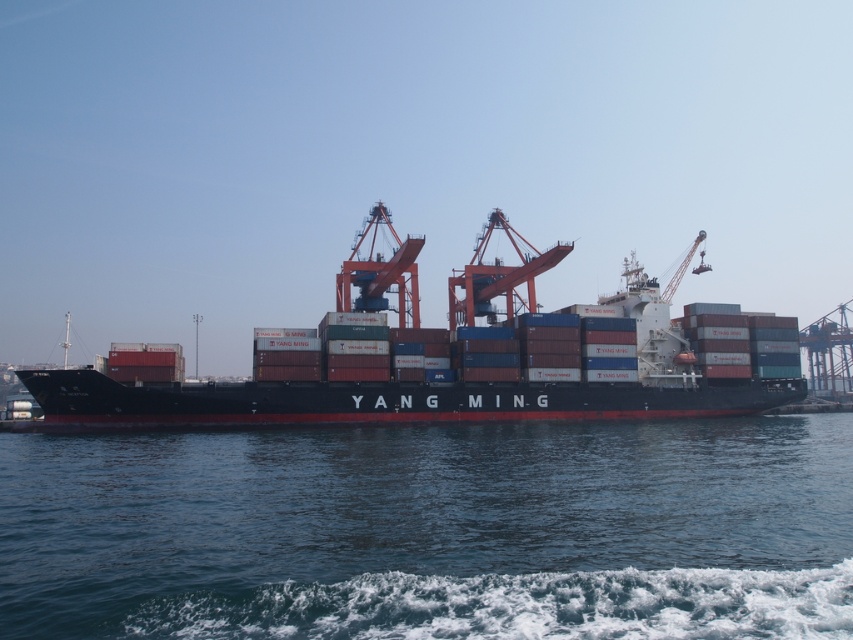
Is blue water at lower center above black matte container ship at center?

Incorrect, blue water at lower center is not positioned above black matte container ship at center.

Which is in front, point (521, 612) or point (256, 371)?

Point (521, 612)

At what (x,y) coordinates should I click in order to perform the action: click on blue water at lower center. Please return your answer as a coordinate pair (x, y). This screenshot has width=853, height=640. Looking at the image, I should click on pyautogui.click(x=432, y=531).